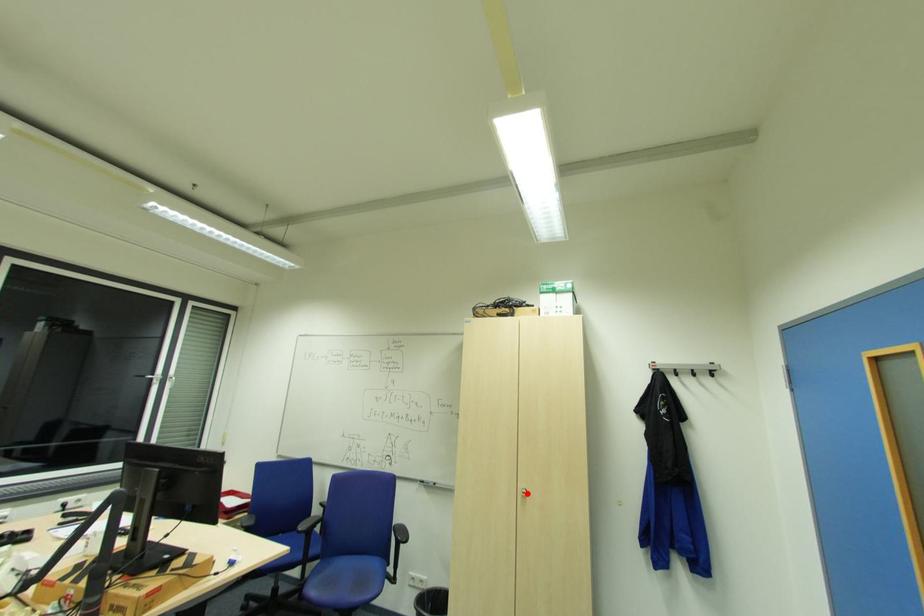
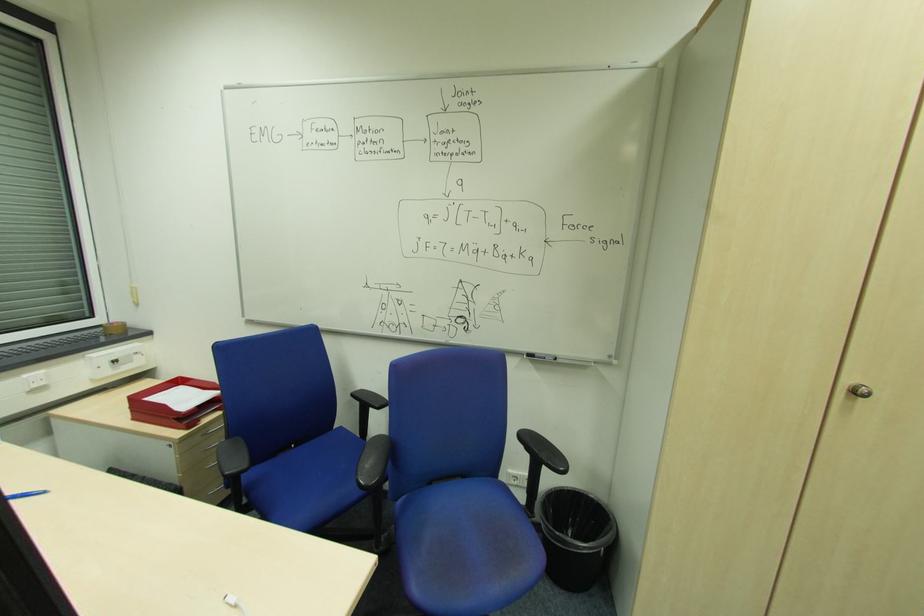
Question: I am providing you with two images of the same scene from different viewpoints. A red point is shown in image1. For the corresponding object point in image2, is it positioned nearer or farther from the camera?

Choices:
 (A) Nearer
 (B) Farther

Answer: (A)